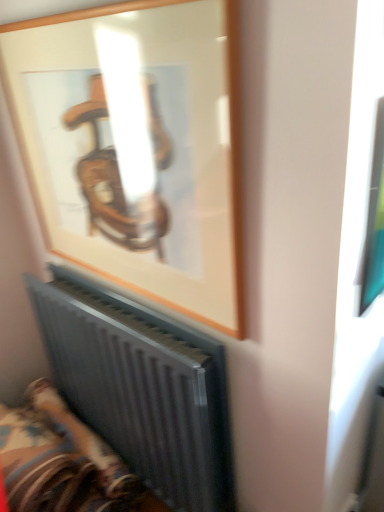
Question: Looking at their shapes, would you say metallic gray radiator at lower left is wider or thinner than wooden frame at upper center?

Choices:
 (A) wide
 (B) thin

Answer: (A)

Question: Is metallic gray radiator at lower left situated inside wooden frame at upper center or outside?

Choices:
 (A) inside
 (B) outside

Answer: (B)

Question: Which of these objects is positioned closest to the wooden frame at upper center?

Choices:
 (A) metallic gray radiator at lower left
 (B) metallic radiator at lower left

Answer: (A)

Question: Which object is positioned closest to the metallic radiator at lower left?

Choices:
 (A) metallic gray radiator at lower left
 (B) wooden frame at upper center

Answer: (A)